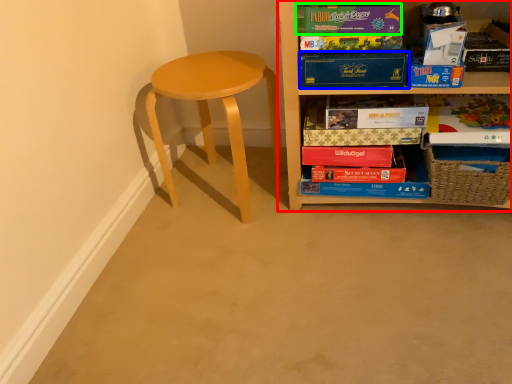
Question: Which is farther away from shelf (highlighted by a red box)? paperback book (highlighted by a blue box) or paperback book (highlighted by a green box)?

Choices:
 (A) paperback book
 (B) paperback book

Answer: (B)